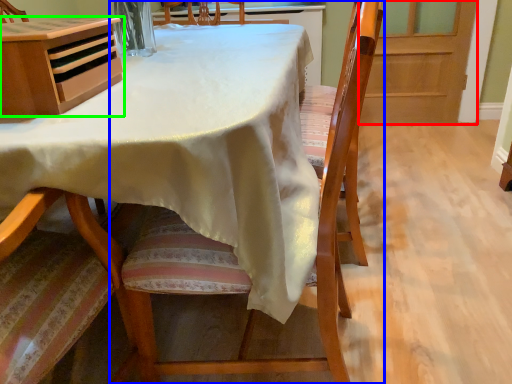
Question: Based on their relative distances, which object is farther from screen door (highlighted by a red box)? Choose from chair (highlighted by a blue box) and cabinetry (highlighted by a green box).

Choices:
 (A) chair
 (B) cabinetry

Answer: (B)